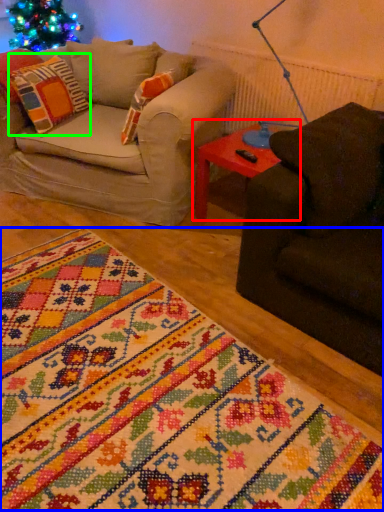
Question: Which object is positioned farthest from table (highlighted by a red box)? Select from blanket (highlighted by a blue box) and pillow (highlighted by a green box).

Choices:
 (A) blanket
 (B) pillow

Answer: (A)